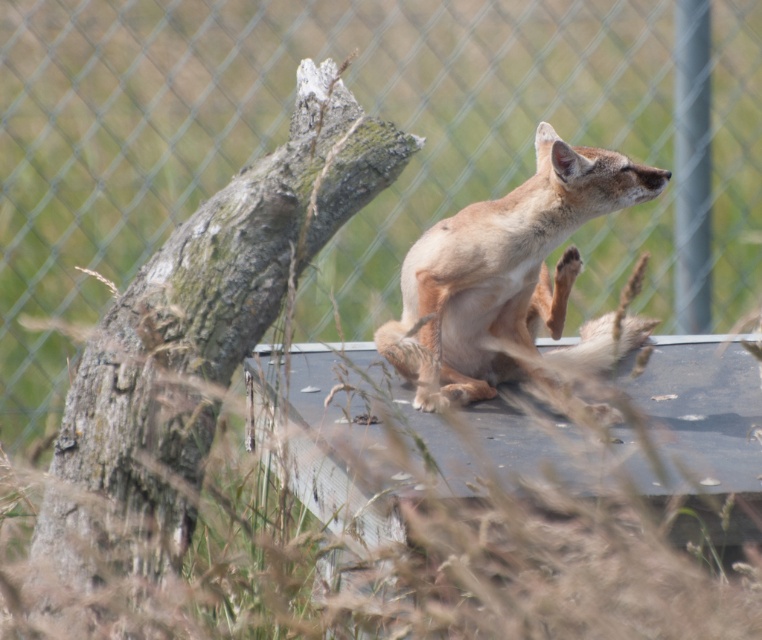
Question: Among these points, which one is farthest from the camera?

Choices:
 (A) (98, 33)
 (B) (61, 460)
 (C) (420, 317)

Answer: (A)

Question: Is green mossy tree trunk at center further to the viewer compared to light brown fur fox at center?

Choices:
 (A) no
 (B) yes

Answer: (A)

Question: Can you confirm if metallic chain-link fence at upper center is thinner than light brown fur fox at center?

Choices:
 (A) yes
 (B) no

Answer: (B)

Question: Does green mossy tree trunk at center appear on the left side of light brown fur fox at center?

Choices:
 (A) yes
 (B) no

Answer: (A)

Question: Which point is closer to the camera taking this photo?

Choices:
 (A) (152, 563)
 (B) (82, 289)

Answer: (A)

Question: Which of the following is the closest to the observer?

Choices:
 (A) metallic chain-link fence at upper center
 (B) light brown fur fox at center
 (C) green mossy tree trunk at center

Answer: (C)